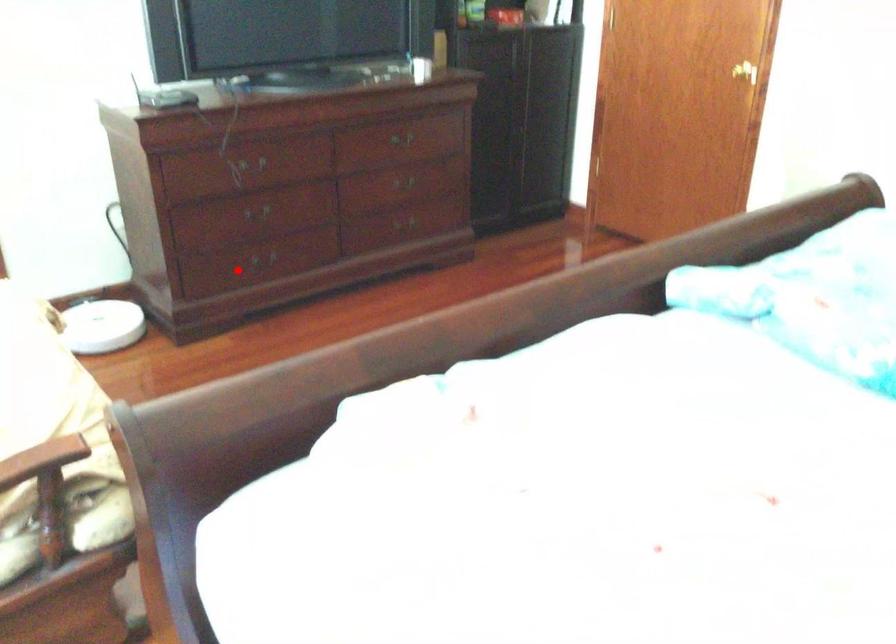
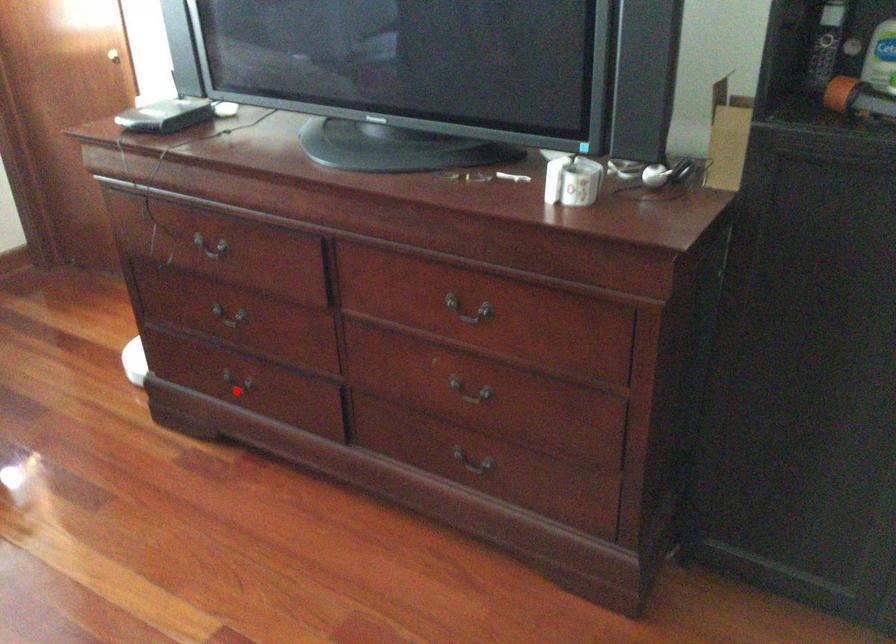
I am providing you with two images of the same scene from different viewpoints. A red point is marked on the first image and another point is marked on the second image. Are the points marked in image1 and image2 representing the same 3D position?

Yes